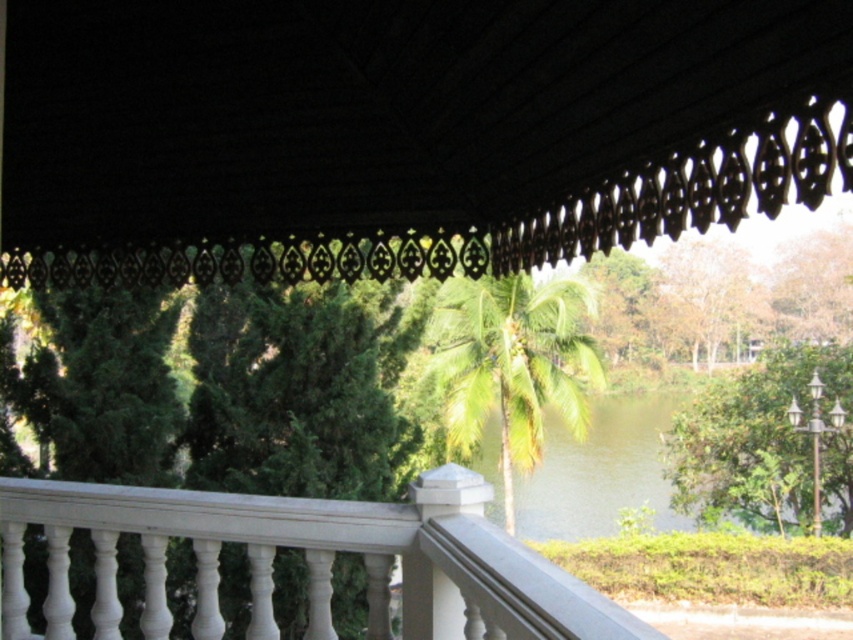
You are standing on the balcony and want to know if the green leafy tree at center is closer to you than the green leafy palm at center. Based on the scene, can you determine this?

The distance between the green leafy tree at center and the green leafy palm at center is 4.93 meters. Since both are in the mid to background, it is unclear which is closer without knowing their exact positions relative to the balcony.

You are standing on the balcony and want to take a photo of the green leafy tree at right. Where should you aim your camera to capture it in the frame?

You should aim your camera at point 0.695 on the x axis and 0.898 on the y axis to capture the green leafy tree at right in the frame.